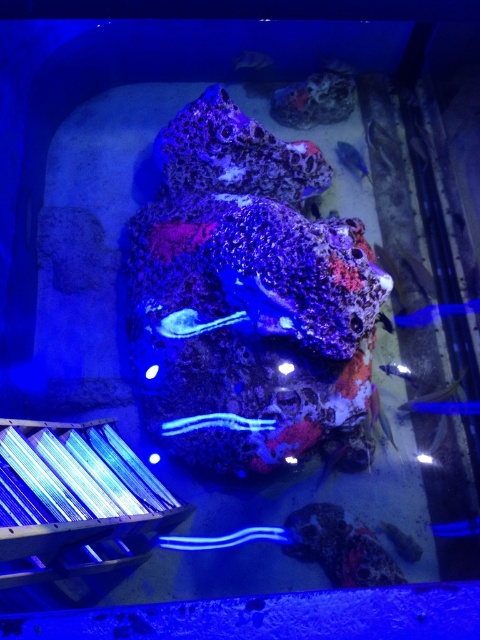
Based on the photo, is speckled coral at center to the right of blue glossy fish at right from the viewer's perspective?

Incorrect, speckled coral at center is not on the right side of blue glossy fish at right.

Does point (357, 428) come in front of point (403, 314)?

That is True.

Find the location of a particular element. Image resolution: width=480 pixels, height=640 pixels. speckled coral at center is located at coordinates (249, 294).

Locate an element on the screen. speckled coral at center is located at coordinates coord(249,294).

Which is behind, point (470, 310) or point (407, 410)?

The point (470, 310) is more distant.

Is blue glossy fish at right to the left of translucent glass fish at lower right from the viewer's perspective?

In fact, blue glossy fish at right is to the right of translucent glass fish at lower right.

This screenshot has height=640, width=480. I want to click on blue glossy fish at right, so click(435, 314).

What do you see at coordinates (432, 396) in the screenshot? Image resolution: width=480 pixels, height=640 pixels. I see `translucent glass fish at lower right` at bounding box center [432, 396].

Which is below, translucent glass fish at lower right or translucent glass fish at center?

translucent glass fish at lower right is lower down.

This screenshot has width=480, height=640. I want to click on translucent glass fish at lower right, so click(x=432, y=396).